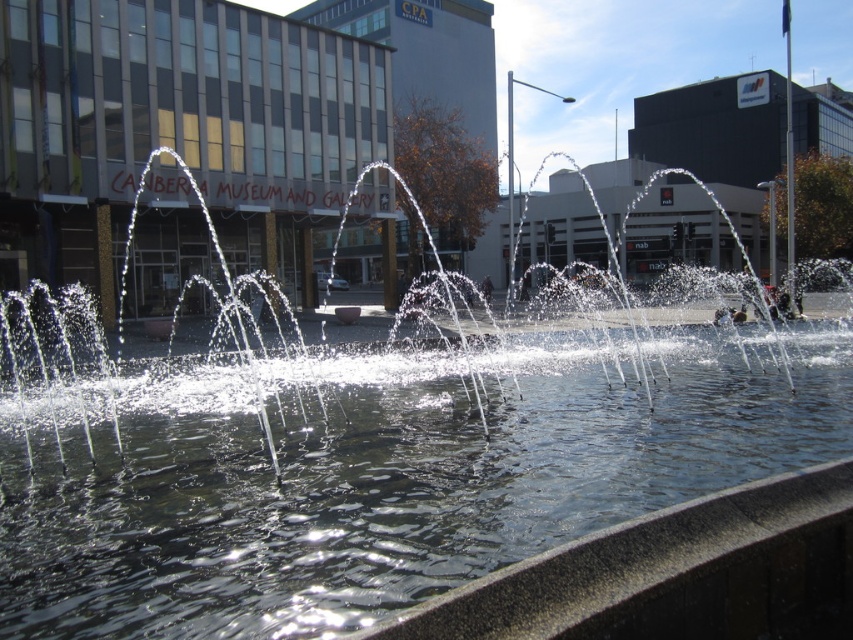
In the scene shown: Is clear water at center bigger than clear water fountain at center?

Incorrect, clear water at center is not larger than clear water fountain at center.

Does clear water at center have a greater width compared to clear water fountain at center?

No, clear water at center is not wider than clear water fountain at center.

The image size is (853, 640). I want to click on clear water at center, so click(386, 476).

Is clear water at center shorter than transparent glass building at center?

Yes, clear water at center is shorter than transparent glass building at center.

Which is more to the left, clear water at center or transparent glass building at center?

clear water at center

The width and height of the screenshot is (853, 640). Find the location of `clear water at center`. clear water at center is located at coordinates (386, 476).

Does clear water fountain at center have a greater height compared to transparent glass building at center?

Incorrect, clear water fountain at center's height is not larger of transparent glass building at center's.

In the scene shown: Between clear water fountain at center and transparent glass building at center, which one has more height?

transparent glass building at center

At what (x,y) coordinates should I click in order to perform the action: click on clear water fountain at center. Please return your answer as a coordinate pair (x, y). This screenshot has height=640, width=853. Looking at the image, I should click on 425,403.

I want to click on clear water fountain at center, so click(425, 403).